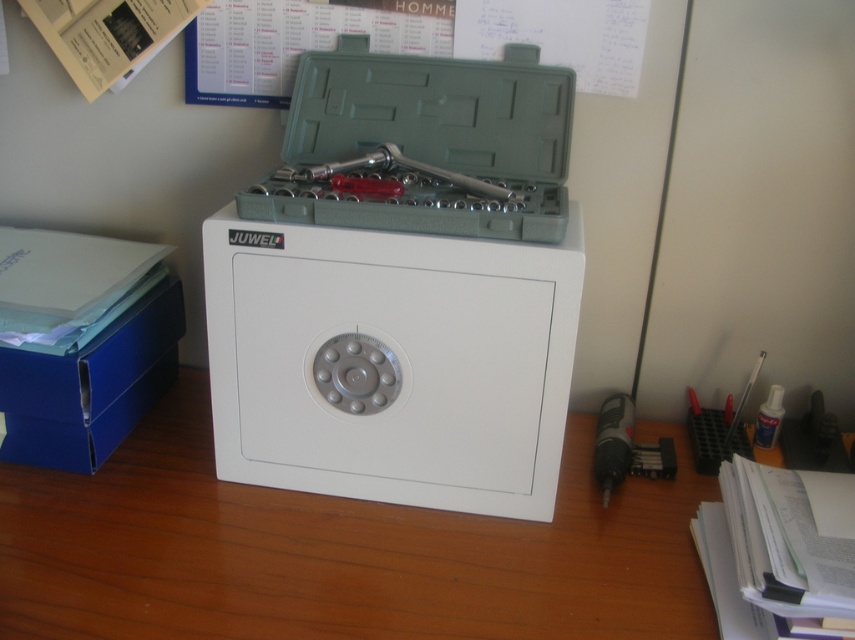
You are standing in front of the white wood table at center. You want to place a 60 cm long tool on the table. Is there enough space for it?

The distance between you and the white wood table at center is 67.03 centimeters. Since the tool is 60 cm long, it will fit as long as the table has sufficient surface area. However, the description does not provide the table dimensions, so we cannot confirm based on the given information.

You are organizing a workshop and need to place a 12cm tall tool on a surface. The white wood table at center and the blue cardboard box at left are available. Which surface can safely hold the tool without it toppling over?

The blue cardboard box at left is taller than the white wood table at center. Since the tool is 12cm tall, placing it on the blue cardboard box at left would be safer to prevent toppling as it provides a more stable base due to its height.